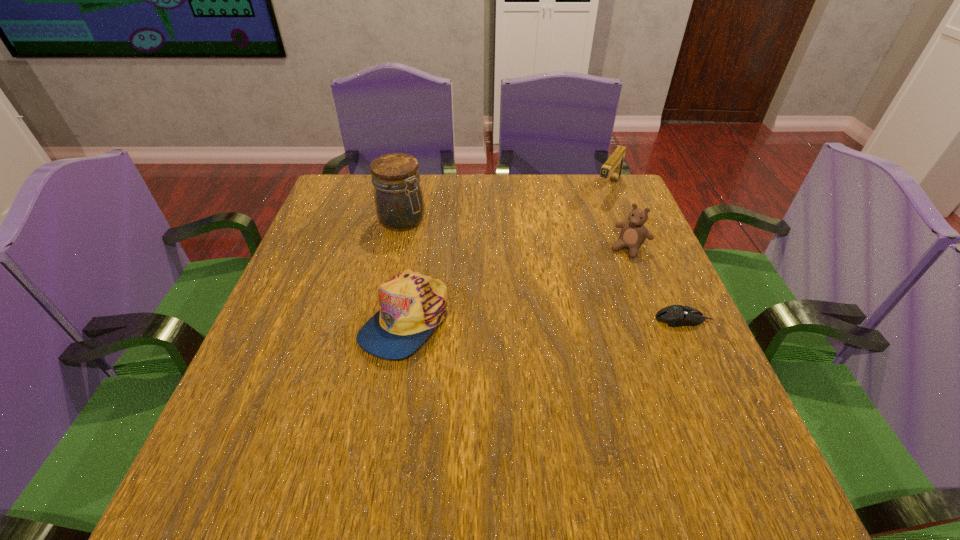
I want to click on free space between the pistol and the cap, so click(x=507, y=254).

Find the location of a particular element. empty location between the cap and the computer mouse is located at coordinates (543, 319).

Where is `empty location between the computer mouse and the pistol`? Image resolution: width=960 pixels, height=540 pixels. empty location between the computer mouse and the pistol is located at coordinates (646, 254).

Image resolution: width=960 pixels, height=540 pixels. In order to click on free spot between the teddy bear and the computer mouse in this screenshot , I will do `click(656, 284)`.

At what (x,y) coordinates should I click in order to perform the action: click on unoccupied position between the computer mouse and the jar. Please return your answer as a coordinate pair (x, y). The height and width of the screenshot is (540, 960). Looking at the image, I should click on (542, 269).

The height and width of the screenshot is (540, 960). Identify the location of unoccupied position between the shortest object and the cap. pyautogui.click(x=543, y=319).

You are a GUI agent. You are given a task and a screenshot of the screen. Output one action in this format:
    pyautogui.click(x=<x>, y=<y>)
    Task: Click on the empty space that is in between the farthest object and the cap
    
    Given the screenshot: What is the action you would take?
    pyautogui.click(x=507, y=254)

Identify the location of vacant region between the shortest object and the third nearest object. The width and height of the screenshot is (960, 540). 656,284.

You are a GUI agent. You are given a task and a screenshot of the screen. Output one action in this format:
    pyautogui.click(x=<x>, y=<y>)
    Task: Click on the fourth closest object relative to the computer mouse
    
    Given the screenshot: What is the action you would take?
    pyautogui.click(x=398, y=197)

Where is `the second closest object relative to the shortest object`? This screenshot has width=960, height=540. the second closest object relative to the shortest object is located at coordinates (613, 166).